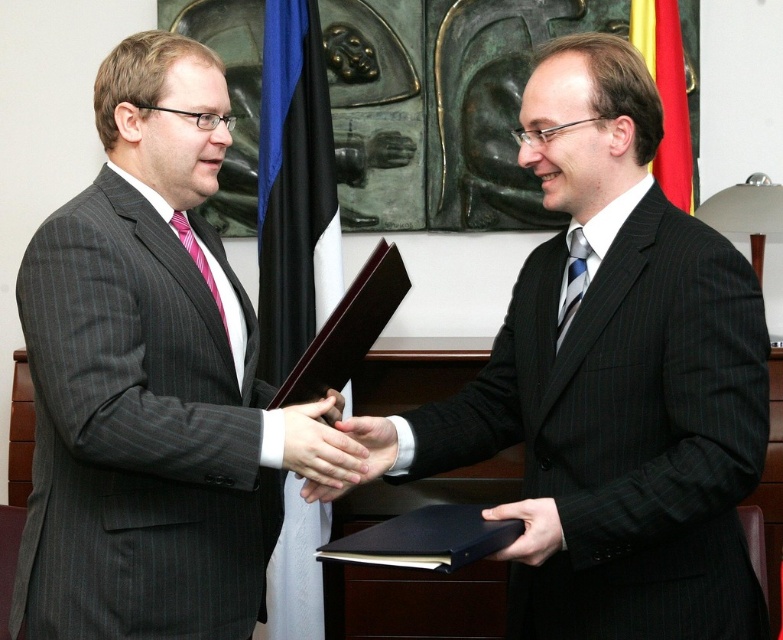
Question: Estimate the real-world distances between objects in this image. Which object is closer to the smooth skin hand at center?

Choices:
 (A) matte black suit at left
 (B) smooth skin hands at center
 (C) black pinstripe suit at center

Answer: (B)

Question: Does black pinstripe suit at center appear under pink striped tie at left?

Choices:
 (A) no
 (B) yes

Answer: (B)

Question: Which of the following is the closest to the observer?

Choices:
 (A) blue striped tie at center
 (B) black leather folder at lower center
 (C) smooth skin hands at center

Answer: (B)

Question: Observing the image, what is the correct spatial positioning of black pinstripe suit at center in reference to blue striped tie at center?

Choices:
 (A) right
 (B) left

Answer: (B)

Question: Does blue striped tie at center lie in front of pink striped tie at left?

Choices:
 (A) no
 (B) yes

Answer: (B)

Question: Estimate the real-world distances between objects in this image. Which object is closer to the matte black suit at left?

Choices:
 (A) smooth skin hand at center
 (B) pink striped tie at left

Answer: (B)